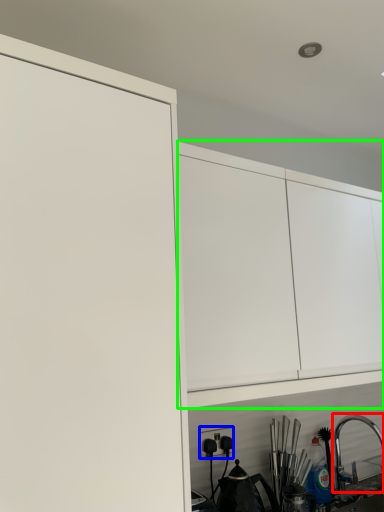
Question: Based on their relative distances, which object is farther from tap (highlighted by a red box)? Choose from electric outlet (highlighted by a blue box) and cabinetry (highlighted by a green box).

Choices:
 (A) electric outlet
 (B) cabinetry

Answer: (B)